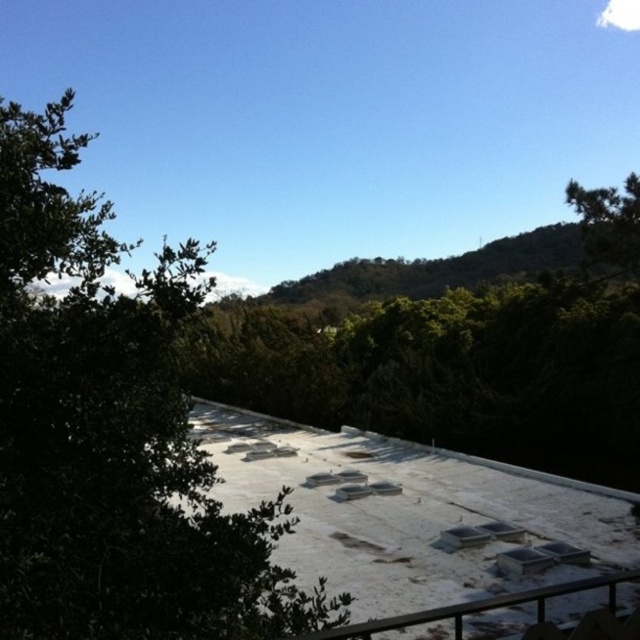
Who is taller, green leafy tree at left or white matte rail at lower right?

With more height is green leafy tree at left.

Based on the photo, between green leafy tree at left and white matte rail at lower right, which one is positioned lower?

white matte rail at lower right is below.

The image size is (640, 640). What do you see at coordinates (113, 435) in the screenshot?
I see `green leafy tree at left` at bounding box center [113, 435].

Image resolution: width=640 pixels, height=640 pixels. I want to click on green leafy tree at left, so click(x=113, y=435).

Between green leafy tree at upper right and white matte rail at lower right, which one is positioned higher?

Positioned higher is green leafy tree at upper right.

Which is behind, point (605, 188) or point (628, 579)?

The point (605, 188) is more distant.

Is point (621, 212) positioned before point (458, 611)?

No, it is behind (458, 611).

Identify the location of green leafy tree at upper right. Image resolution: width=640 pixels, height=640 pixels. (609, 227).

Is green leafy tree at left taller than green leafy tree at upper right?

Indeed, green leafy tree at left has a greater height compared to green leafy tree at upper right.

Is green leafy tree at left positioned before green leafy tree at upper right?

Yes.

Locate an element on the screen. The image size is (640, 640). green leafy tree at left is located at coordinates (113, 435).

The width and height of the screenshot is (640, 640). I want to click on green leafy tree at left, so click(x=113, y=435).